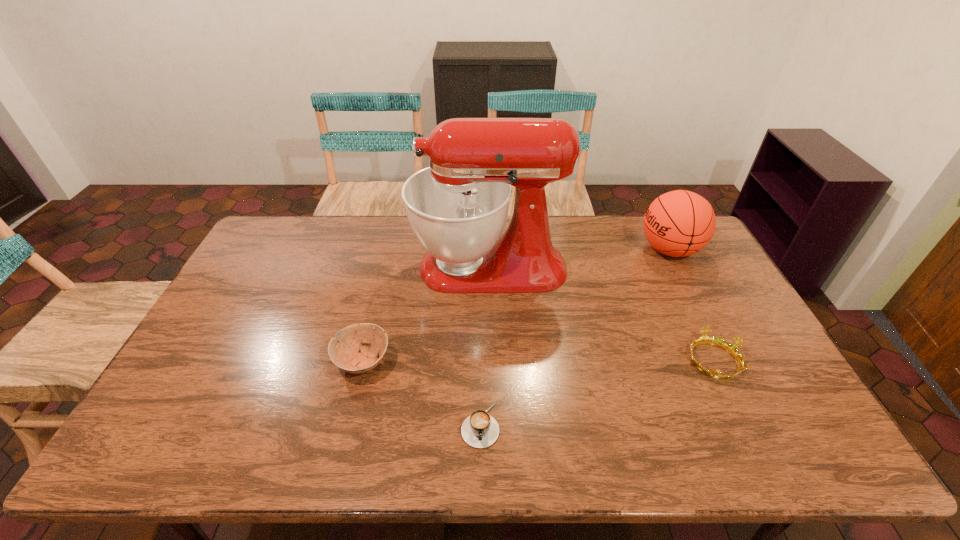
In the image, there is a desktop. In order to click on vacant space at the far edge in this screenshot , I will do `click(329, 238)`.

Identify the location of vacant space at the near edge of the desktop. (352, 441).

At what (x,y) coordinates should I click in order to perform the action: click on blank space at the right edge. Please return your answer as a coordinate pair (x, y). Looking at the image, I should click on (756, 388).

This screenshot has height=540, width=960. I want to click on free space at the near right corner of the desktop, so click(x=809, y=447).

You are a GUI agent. You are given a task and a screenshot of the screen. Output one action in this format:
    pyautogui.click(x=<x>, y=<y>)
    Task: Click on the vacant space in between the leftmost object and the nearest object
    This screenshot has height=540, width=960.
    Given the screenshot: What is the action you would take?
    pyautogui.click(x=421, y=393)

Locate an element on the screen. free space that is in between the third tallest object and the mixer is located at coordinates (426, 314).

Where is `free space between the third tallest object and the basketball`? The image size is (960, 540). free space between the third tallest object and the basketball is located at coordinates (516, 306).

Identify the location of free space between the third tallest object and the mixer. The height and width of the screenshot is (540, 960). pos(426,314).

Identify the location of vacant space in between the fourth shortest object and the mixer. The width and height of the screenshot is (960, 540). (579, 259).

You are a GUI agent. You are given a task and a screenshot of the screen. Output one action in this format:
    pyautogui.click(x=<x>, y=<y>)
    Task: Click on the vacant space that's between the nearest object and the tallest object
    The width and height of the screenshot is (960, 540).
    Given the screenshot: What is the action you would take?
    pyautogui.click(x=485, y=346)